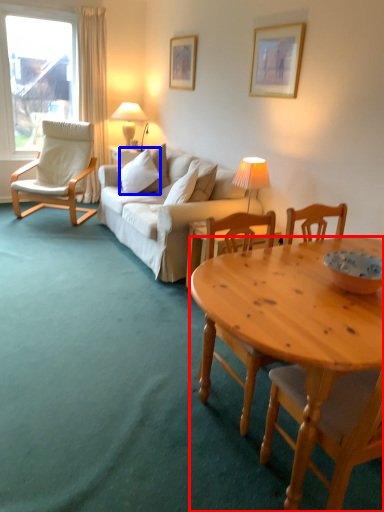
Question: Among these objects, which one is nearest to the camera, desk (highlighted by a red box) or pillow (highlighted by a blue box)?

Choices:
 (A) desk
 (B) pillow

Answer: (A)